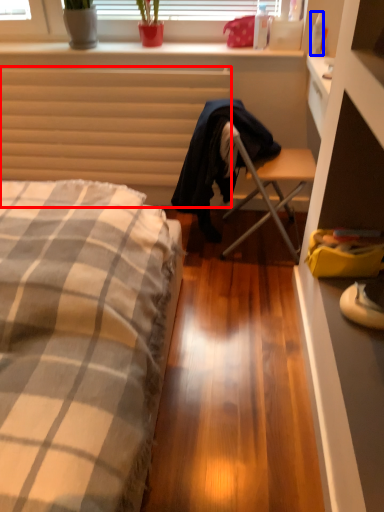
Question: Which point is closer to the camera, radiator (highlighted by a red box) or bottle (highlighted by a blue box)?

Choices:
 (A) radiator
 (B) bottle

Answer: (B)